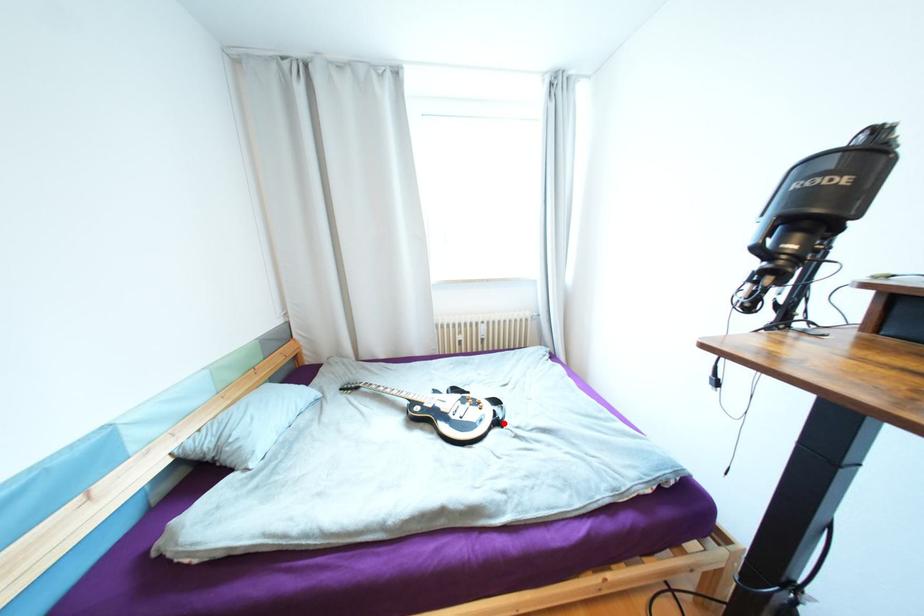
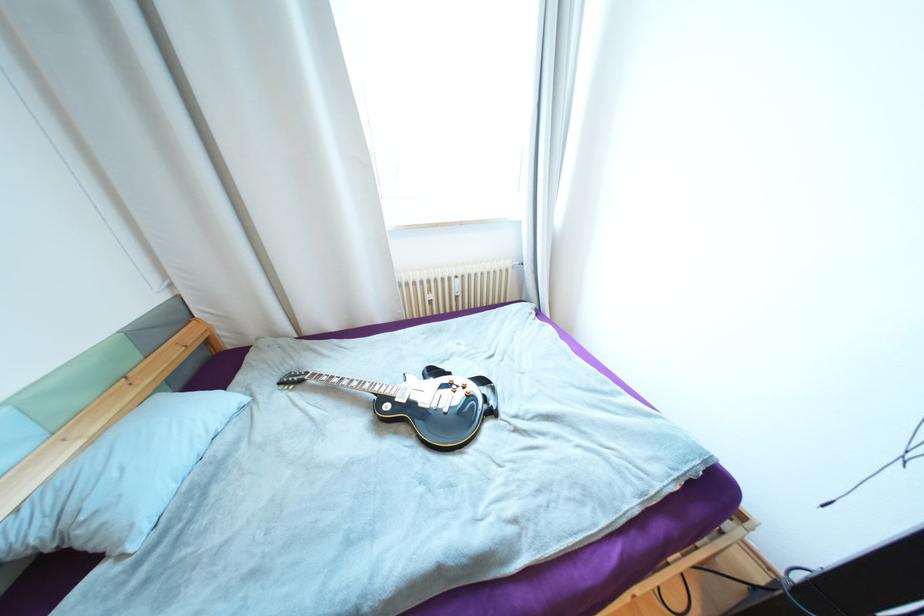
In the second image, find the point that corresponds to the highlighted location in the first image.

(497, 413)